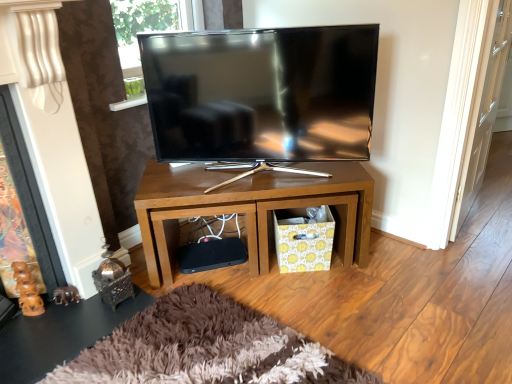
Locate an element on the screen. This screenshot has width=512, height=384. free point above yellow floral cardboard crate at lower center (from a real-world perspective) is located at coordinates (298, 216).